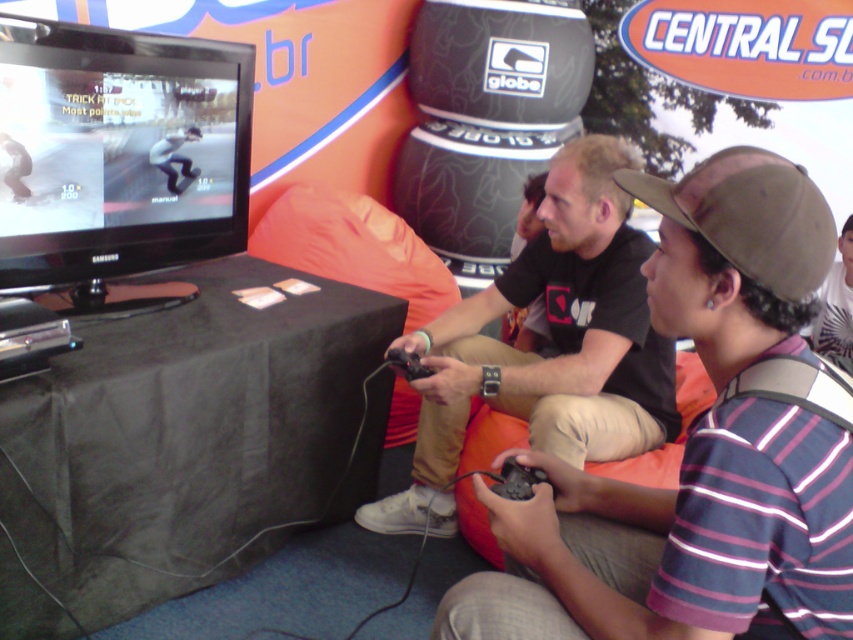
You are organizing a clothing display and need to hang the striped cotton shirt at center and the black matte shirt at center on a rack. If the rack has a limited width, which shirt should you place first to ensure both fit?

The striped cotton shirt at center is thinner than the black matte shirt at center, so you should place the striped cotton shirt at center first to accommodate the wider black matte shirt at center.

You are a photographer at the event and need to position two shirts for a photo shoot. The striped cotton shirt at center and the black matte shirt at center must be arranged so that the taller one is behind the shorter one. Which shirt should be placed in front?

The striped cotton shirt at center is not as tall as the black matte shirt at center, so the black matte shirt at center should be placed behind the striped cotton shirt at center to ensure the taller one is behind the shorter one.

You are at an event and want to find the striped cotton shirt at center and the black matte shirt at center. Which one is positioned more to the left?

The black matte shirt at center is positioned more to the left than the striped cotton shirt at center.